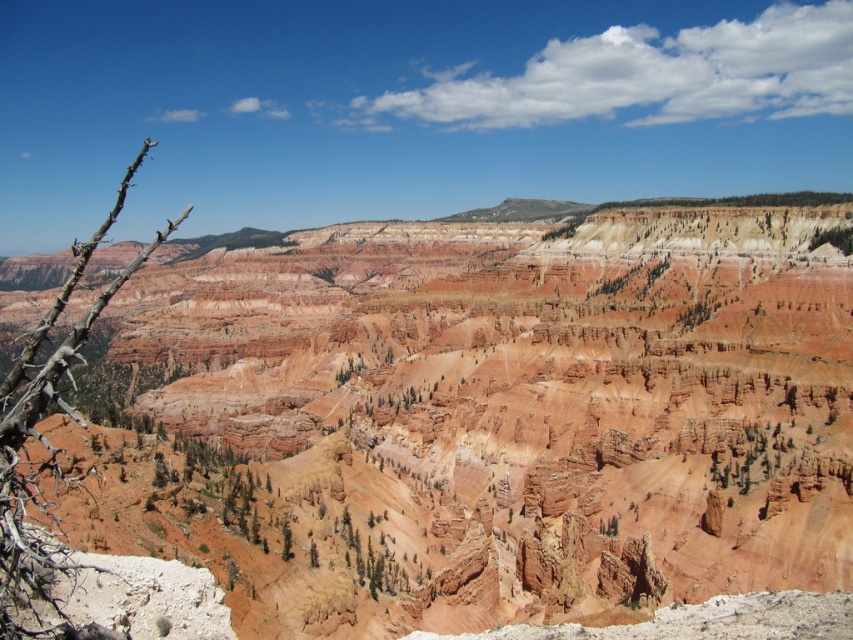
Can you confirm if rustic sandstone canyon at center is wider than green leafy tree at center?

Yes.

Does point (73, 531) come in front of point (850, 227)?

Yes, it is in front of point (850, 227).

Locate an element on the screen. Image resolution: width=853 pixels, height=640 pixels. rustic sandstone canyon at center is located at coordinates (491, 417).

Who is positioned more to the left, rustic sandstone canyon at center or brown thorny branch at left?

brown thorny branch at left is more to the left.

Where is `rustic sandstone canyon at center`? The width and height of the screenshot is (853, 640). rustic sandstone canyon at center is located at coordinates (491, 417).

Who is higher up, brown thorny branch at left or green leafy tree at center?

brown thorny branch at left

Does brown thorny branch at left have a smaller size compared to green leafy tree at center?

No, brown thorny branch at left is not smaller than green leafy tree at center.

You are a GUI agent. You are given a task and a screenshot of the screen. Output one action in this format:
    pyautogui.click(x=<x>, y=<y>)
    Task: Click on the brown thorny branch at left
    
    Given the screenshot: What is the action you would take?
    pyautogui.click(x=44, y=436)